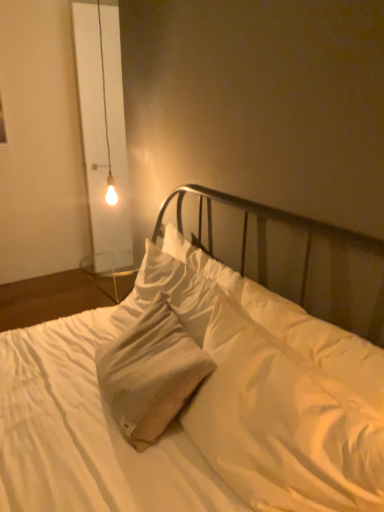
What do you see at coordinates (106, 124) in the screenshot?
I see `matte glass bulb at upper left` at bounding box center [106, 124].

Measure the distance between white cotton pillow at center and camera.

They are 94.02 centimeters apart.

The height and width of the screenshot is (512, 384). Describe the element at coordinates (196, 405) in the screenshot. I see `white cotton bed at center` at that location.

Identify the location of matte glass bulb at upper left. (106, 124).

Is white cotton bed at center at the back of matte glass bulb at upper left?

No, matte glass bulb at upper left is not facing the opposite direction of white cotton bed at center.

Is there a large distance between matte glass bulb at upper left and white cotton bed at center?

Yes, matte glass bulb at upper left and white cotton bed at center are located far from each other.

Is matte glass bulb at upper left smaller than white cotton bed at center?

Yes.

From the image's perspective, does matte glass bulb at upper left appear higher than white cotton bed at center?

Yes.

In the scene shown: Which object is positioned more to the right, matte glass bulb at upper left or white cotton pillow at center?

From the viewer's perspective, white cotton pillow at center appears more on the right side.

Which of these two, matte glass bulb at upper left or white cotton pillow at center, stands taller?

matte glass bulb at upper left.

Looking at their sizes, would you say matte glass bulb at upper left is wider or thinner than white cotton pillow at center?

In the image, matte glass bulb at upper left appears to be more narrow than white cotton pillow at center.

From a real-world perspective, is matte glass bulb at upper left under white cotton pillow at center?

No.

Is point (319, 327) closer to camera compared to point (101, 39)?

Yes, point (319, 327) is in front of point (101, 39).

In terms of size, does white cotton pillow at center appear bigger or smaller than matte glass bulb at upper left?

Considering their sizes, white cotton pillow at center takes up more space than matte glass bulb at upper left.

Between white cotton pillow at center and matte glass bulb at upper left, which one has larger width?

white cotton pillow at center.

Considering the relative sizes of white cotton pillow at center and white cotton bed at center in the image provided, is white cotton pillow at center shorter than white cotton bed at center?

Yes.

Between white cotton pillow at center and white cotton bed at center, which one is positioned behind?

white cotton pillow at center.

From the picture: Which is more to the left, white cotton pillow at center or white cotton bed at center?

Positioned to the left is white cotton bed at center.

From the image's perspective, which is below, white cotton pillow at center or white cotton bed at center?

white cotton pillow at center, from the image's perspective.

From the image's perspective, relative to white cotton pillow at center, is white cotton bed at center above or below?

Based on their image positions, white cotton bed at center is located above white cotton pillow at center.

Is white cotton bed at center facing towards white cotton pillow at center?

Yes, white cotton bed at center is facing white cotton pillow at center.

Find the location of a particular element. The height and width of the screenshot is (512, 384). pillow located on the right of white cotton bed at center is located at coordinates (294, 325).

Is white cotton bed at center surrounding white cotton pillow at center?

Yes, white cotton pillow at center is surrounded by white cotton bed at center.

Can you confirm if white cotton bed at center is smaller than matte glass bulb at upper left?

No, white cotton bed at center is not smaller than matte glass bulb at upper left.

Is white cotton bed at center wider than matte glass bulb at upper left?

Yes, white cotton bed at center is wider than matte glass bulb at upper left.

Relative to matte glass bulb at upper left, is white cotton bed at center in front or behind?

Clearly, white cotton bed at center is in front of matte glass bulb at upper left.

Is matte glass bulb at upper left at the back of white cotton bed at center?

white cotton bed at center is not turned away from matte glass bulb at upper left.

The image size is (384, 512). I want to click on bed directly beneath the matte glass bulb at upper left (from a real-world perspective), so click(x=196, y=405).

The width and height of the screenshot is (384, 512). Identify the location of pillow below the matte glass bulb at upper left (from the image's perspective). (294, 325).

Looking at the image, which one is located closer to matte glass bulb at upper left, white cotton bed at center or white cotton pillow at center?

white cotton pillow at center is positioned closer to the anchor matte glass bulb at upper left.

Based on the photo, when comparing their distances from white cotton bed at center, does matte glass bulb at upper left or white cotton pillow at center seem further?

matte glass bulb at upper left is positioned further to the anchor white cotton bed at center.

Looking at the image, which one is located closer to matte glass bulb at upper left, white cotton pillow at center or white cotton bed at center?

white cotton pillow at center lies closer to matte glass bulb at upper left than the other object.

Estimate the real-world distances between objects in this image. Which object is closer to white cotton pillow at center, matte glass bulb at upper left or white cotton bed at center?

Based on the image, white cotton bed at center appears to be nearer to white cotton pillow at center.

Estimate the real-world distances between objects in this image. Which object is closer to white cotton bed at center, white cotton pillow at center or matte glass bulb at upper left?

white cotton pillow at center is closer to white cotton bed at center.

Considering their positions, is white cotton bed at center positioned closer to white cotton pillow at center than matte glass bulb at upper left?

white cotton bed at center is closer to white cotton pillow at center.

This screenshot has width=384, height=512. Find the location of `pillow between white cotton bed at center and matte glass bulb at upper left along the z-axis`. pillow between white cotton bed at center and matte glass bulb at upper left along the z-axis is located at coordinates (294, 325).